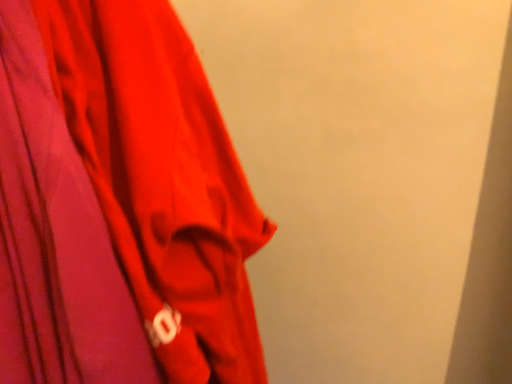
The width and height of the screenshot is (512, 384). Describe the element at coordinates (119, 204) in the screenshot. I see `matte red fabric at left` at that location.

The width and height of the screenshot is (512, 384). What are the coordinates of `matte red fabric at left` in the screenshot? It's located at (119, 204).

Image resolution: width=512 pixels, height=384 pixels. I want to click on matte red fabric at left, so click(x=119, y=204).